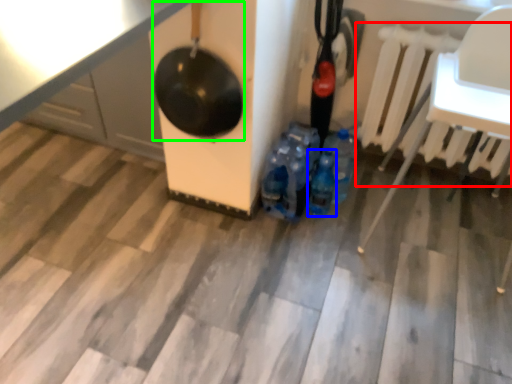
Question: Estimate the real-world distances between objects in this image. Which object is farther from radiator (highlighted by a red box), bottle (highlighted by a blue box) or wok (highlighted by a green box)?

Choices:
 (A) bottle
 (B) wok

Answer: (B)